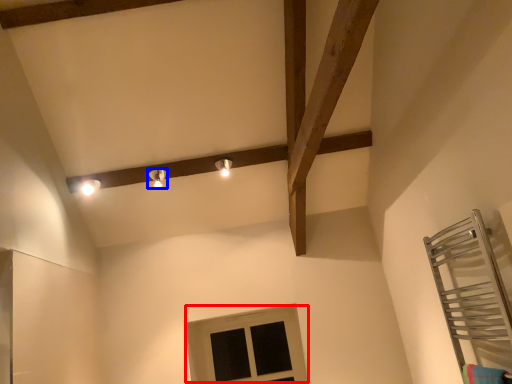
Question: Which object appears farthest to the camera in this image, window (highlighted by a red box) or light fixture (highlighted by a blue box)?

Choices:
 (A) window
 (B) light fixture

Answer: (A)